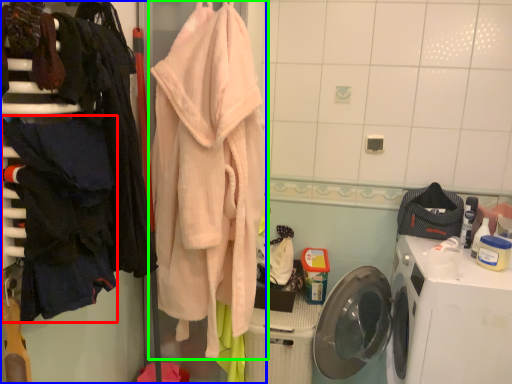
Question: Which object is positioned closest to clothing (highlighted by a red box)? Select from closet (highlighted by a blue box) and towel (highlighted by a green box).

Choices:
 (A) closet
 (B) towel

Answer: (A)